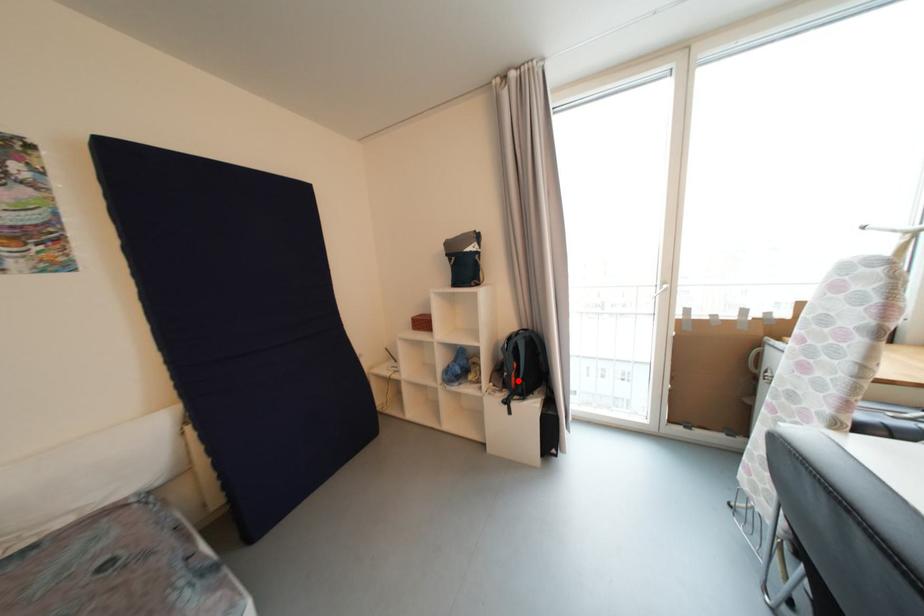
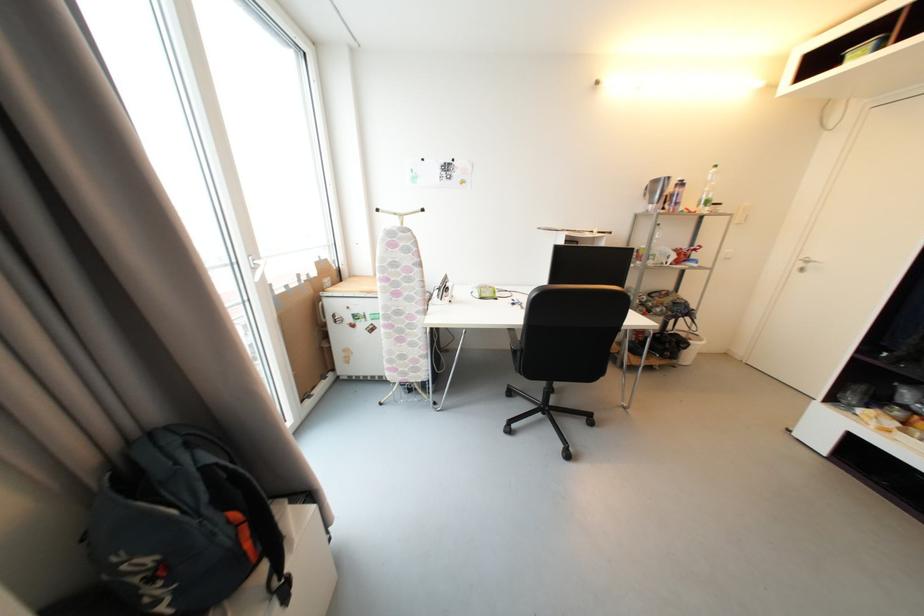
Question: I am providing you with two images of the same scene from different viewpoints. Given a red point in image1, look at the same physical point in image2. Is it:

Choices:
 (A) Closer to the viewpoint
 (B) Farther from the viewpoint

Answer: (A)